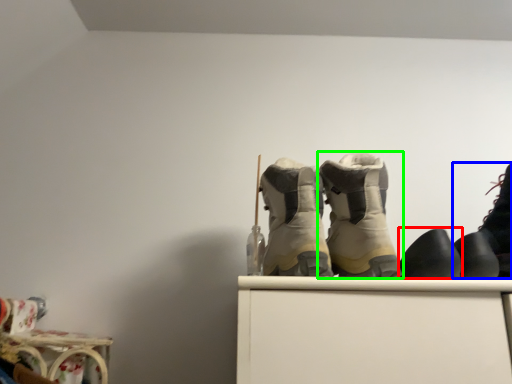
Question: Estimate the real-world distances between objects in this image. Which object is closer to footwear (highlighted by a red box), footwear (highlighted by a blue box) or footwear (highlighted by a green box)?

Choices:
 (A) footwear
 (B) footwear

Answer: (B)